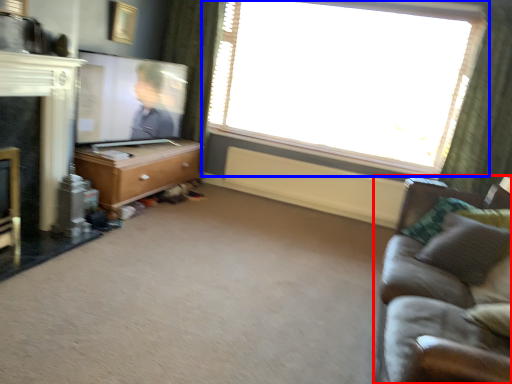
Question: Among these objects, which one is farthest to the camera, studio couch (highlighted by a red box) or window (highlighted by a blue box)?

Choices:
 (A) studio couch
 (B) window

Answer: (B)